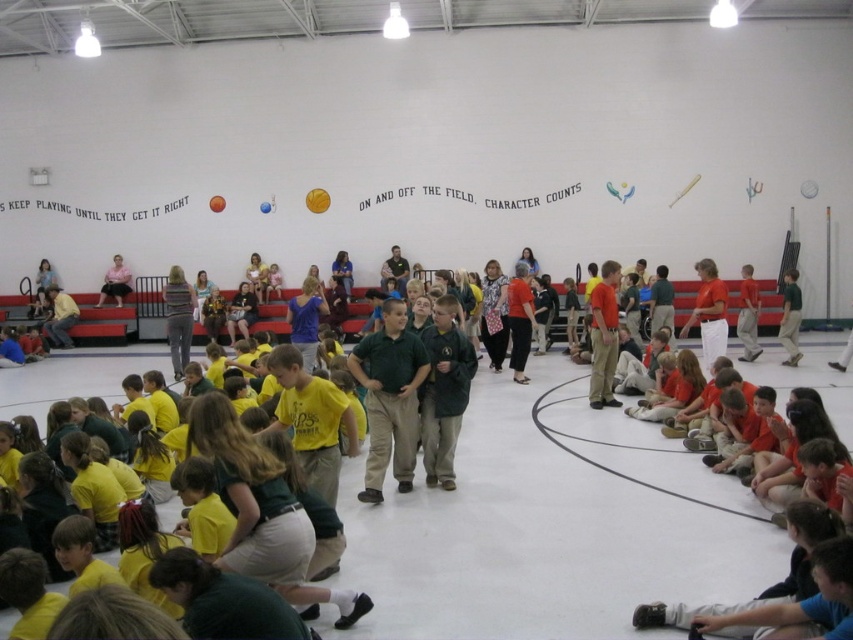
Question: Is khaki pants at center smaller than yellow rubber balloon at upper center?

Choices:
 (A) no
 (B) yes

Answer: (A)

Question: Which point is closer to the camera?

Choices:
 (A) (224, 200)
 (B) (260, 204)
 (C) (323, 200)
 (D) (108, 273)

Answer: (C)

Question: Which point is closer to the camera?

Choices:
 (A) (260, 204)
 (B) (318, 202)
 (C) (401, 488)

Answer: (C)

Question: Is pink fabric skirt at lower left thinner than rubber balloon at center?

Choices:
 (A) no
 (B) yes

Answer: (A)

Question: Which of the following is the farthest from the observer?

Choices:
 (A) (311, 196)
 (B) (262, 204)
 (C) (218, 209)

Answer: (C)

Question: Is pink fabric skirt at lower left closer to camera compared to rubber balloon at center?

Choices:
 (A) yes
 (B) no

Answer: (B)